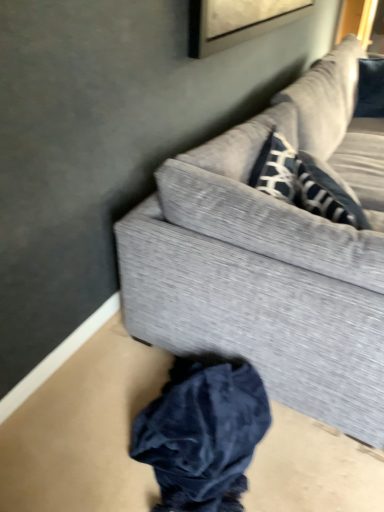
Locate an element on the screen. textured gray couch at upper right is located at coordinates 272,256.

What do you see at coordinates (272, 256) in the screenshot?
I see `textured gray couch at upper right` at bounding box center [272, 256].

Find the location of a particular element. The width and height of the screenshot is (384, 512). dark blue velvet clothing at lower center is located at coordinates (202, 435).

The image size is (384, 512). What do you see at coordinates (202, 435) in the screenshot?
I see `dark blue velvet clothing at lower center` at bounding box center [202, 435].

Where is `textured gray couch at upper right`? The image size is (384, 512). textured gray couch at upper right is located at coordinates (272, 256).

Based on the photo, visually, is textured gray couch at upper right positioned to the left or to the right of dark blue velvet clothing at lower center?

textured gray couch at upper right is positioned on dark blue velvet clothing at lower center's right side.

Is the position of textured gray couch at upper right more distant than that of dark blue velvet clothing at lower center?

No.

Which is in front, point (161, 287) or point (221, 431)?

Positioned in front is point (221, 431).

From the image's perspective, is textured gray couch at upper right positioned above or below dark blue velvet clothing at lower center?

Clearly, from the image's perspective, textured gray couch at upper right is above dark blue velvet clothing at lower center.

From a real-world perspective, between textured gray couch at upper right and dark blue velvet clothing at lower center, who is vertically higher?

In real-world perspective, textured gray couch at upper right is above.

Between textured gray couch at upper right and dark blue velvet clothing at lower center, which one has smaller width?

With smaller width is dark blue velvet clothing at lower center.

Is textured gray couch at upper right shorter than dark blue velvet clothing at lower center?

No, textured gray couch at upper right is not shorter than dark blue velvet clothing at lower center.

Considering the sizes of textured gray couch at upper right and dark blue velvet clothing at lower center in the image, is textured gray couch at upper right bigger or smaller than dark blue velvet clothing at lower center?

Clearly, textured gray couch at upper right is larger in size than dark blue velvet clothing at lower center.

Is textured gray couch at upper right inside or outside of dark blue velvet clothing at lower center?

The correct answer is: outside.

Are textured gray couch at upper right and dark blue velvet clothing at lower center far apart?

No.

Is textured gray couch at upper right turned away from dark blue velvet clothing at lower center?

Yes, textured gray couch at upper right is positioned with its back facing dark blue velvet clothing at lower center.

From the picture: How much distance is there between textured gray couch at upper right and dark blue velvet clothing at lower center?

textured gray couch at upper right and dark blue velvet clothing at lower center are 52.02 centimeters apart.

Locate an element on the screen. The height and width of the screenshot is (512, 384). clothing located underneath the textured gray couch at upper right (from a real-world perspective) is located at coordinates (202, 435).

Which is more to the left, dark blue velvet clothing at lower center or textured gray couch at upper right?

dark blue velvet clothing at lower center is more to the left.

Who is more distant, dark blue velvet clothing at lower center or textured gray couch at upper right?

dark blue velvet clothing at lower center is behind.

Which is closer to the camera, (227, 370) or (293, 115)?

Positioned in front is point (227, 370).

Looking at this image, from the image's perspective, which is below, dark blue velvet clothing at lower center or textured gray couch at upper right?

From the image's view, dark blue velvet clothing at lower center is below.

From a real-world perspective, is dark blue velvet clothing at lower center positioned under textured gray couch at upper right based on gravity?

Yes.

Which of these two, dark blue velvet clothing at lower center or textured gray couch at upper right, is thinner?

Thinner between the two is dark blue velvet clothing at lower center.

Considering the sizes of objects dark blue velvet clothing at lower center and textured gray couch at upper right in the image provided, who is shorter, dark blue velvet clothing at lower center or textured gray couch at upper right?

dark blue velvet clothing at lower center is shorter.

Considering the sizes of dark blue velvet clothing at lower center and textured gray couch at upper right in the image, is dark blue velvet clothing at lower center bigger or smaller than textured gray couch at upper right?

Considering their sizes, dark blue velvet clothing at lower center takes up less space than textured gray couch at upper right.

Is textured gray couch at upper right completely or partially inside dark blue velvet clothing at lower center?

That's incorrect, textured gray couch at upper right is not inside dark blue velvet clothing at lower center.

Consider the image. Is dark blue velvet clothing at lower center directly adjacent to textured gray couch at upper right?

No, dark blue velvet clothing at lower center is not touching textured gray couch at upper right.

Is textured gray couch at upper right at the back of dark blue velvet clothing at lower center?

dark blue velvet clothing at lower center is not turned away from textured gray couch at upper right.

How many degrees apart are the facing directions of dark blue velvet clothing at lower center and textured gray couch at upper right?

dark blue velvet clothing at lower center and textured gray couch at upper right are facing 76.4 degrees away from each other.

Looking at this image, measure the distance between dark blue velvet clothing at lower center and textured gray couch at upper right.

A distance of 20.48 inches exists between dark blue velvet clothing at lower center and textured gray couch at upper right.

Find the location of a particular element. This screenshot has width=384, height=512. studio couch that is in front of the dark blue velvet clothing at lower center is located at coordinates (272, 256).

There is a dark blue velvet clothing at lower center. Where is `studio couch above it (from a real-world perspective)`? The width and height of the screenshot is (384, 512). studio couch above it (from a real-world perspective) is located at coordinates (272, 256).

At what (x,y) coordinates should I click in order to perform the action: click on clothing below the textured gray couch at upper right (from a real-world perspective). Please return your answer as a coordinate pair (x, y). Looking at the image, I should click on (202, 435).